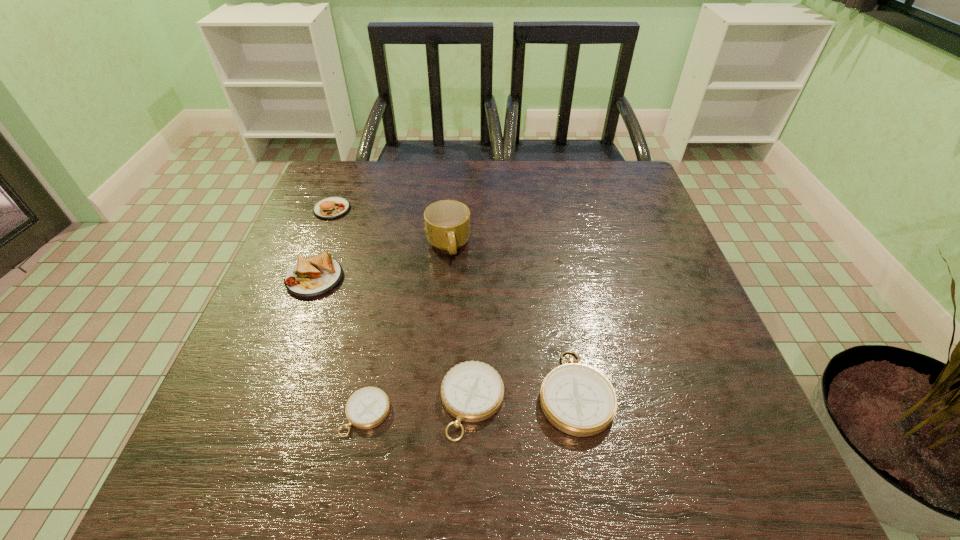
This screenshot has height=540, width=960. In order to click on empty space that is in between the second tallest compass and the farthest object in this screenshot , I will do `click(402, 306)`.

Where is `blank region between the farthest object and the leftmost compass`? The width and height of the screenshot is (960, 540). blank region between the farthest object and the leftmost compass is located at coordinates (349, 311).

Find the location of a particular element. This screenshot has height=540, width=960. free spot between the fifth shortest object and the mug is located at coordinates (390, 227).

Locate an element on the screen. This screenshot has height=540, width=960. object that can be found as the third closest to the rightmost compass is located at coordinates (447, 222).

This screenshot has width=960, height=540. I want to click on object that is the fourth nearest to the sandwich, so click(472, 391).

Where is `compass that is the third closest one to the sandwich`? compass that is the third closest one to the sandwich is located at coordinates (579, 400).

Locate an element on the screen. compass that stands as the second closest to the third object from left to right is located at coordinates click(579, 400).

Identify the location of free space in the image that satisfies the following two spatial constraints: 1. on the front side of the sandwich; 2. on the left side of the second tallest compass. The height and width of the screenshot is (540, 960). (268, 402).

Where is `vacant region that satisfies the following two spatial constraints: 1. on the side with the handle of the tallest object; 2. on the right side of the rightmost compass`? The width and height of the screenshot is (960, 540). vacant region that satisfies the following two spatial constraints: 1. on the side with the handle of the tallest object; 2. on the right side of the rightmost compass is located at coordinates (437, 392).